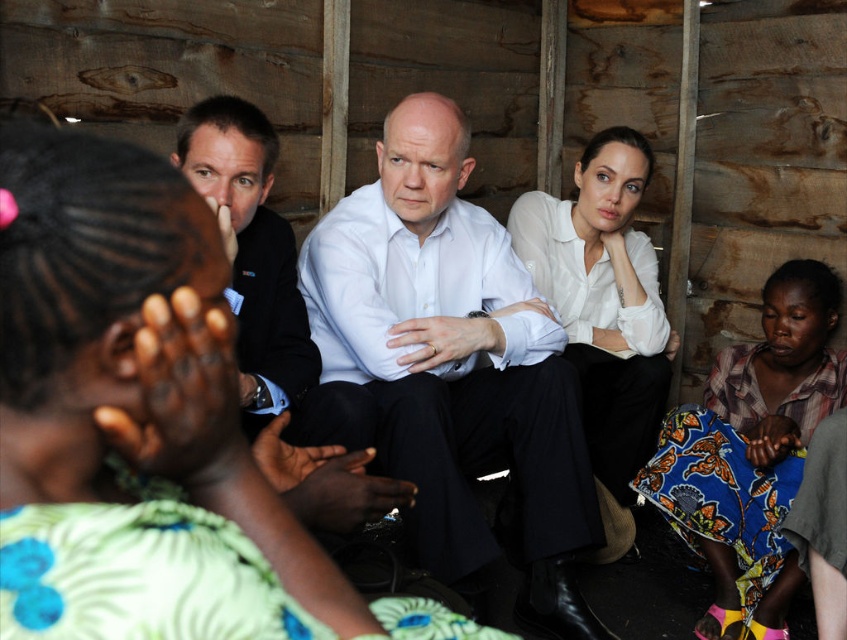
Can you confirm if printed fabric dress at lower right is thinner than black suit at center?

Incorrect, printed fabric dress at lower right's width is not less than black suit at center's.

Does printed fabric dress at lower right have a greater width compared to black suit at center?

Correct, the width of printed fabric dress at lower right exceeds that of black suit at center.

The width and height of the screenshot is (847, 640). What do you see at coordinates (751, 452) in the screenshot? I see `printed fabric dress at lower right` at bounding box center [751, 452].

Identify the location of printed fabric dress at lower right. The height and width of the screenshot is (640, 847). (751, 452).

From the picture: Can you confirm if white smooth shirt at center is positioned below white sheer blouse at center?

Yes, white smooth shirt at center is below white sheer blouse at center.

Which of these two, white smooth shirt at center or white sheer blouse at center, stands taller?

white smooth shirt at center is taller.

Between point (460, 586) and point (535, 269), which one is positioned in front?

Point (460, 586) is more forward.

Locate an element on the screen. This screenshot has width=847, height=640. white smooth shirt at center is located at coordinates (454, 364).

The width and height of the screenshot is (847, 640). Describe the element at coordinates (142, 422) in the screenshot. I see `matte white blouse at center` at that location.

Between point (46, 428) and point (779, 276), which one is positioned behind?

The point (779, 276) is behind.

The height and width of the screenshot is (640, 847). What are the coordinates of `matte white blouse at center` in the screenshot? It's located at (142, 422).